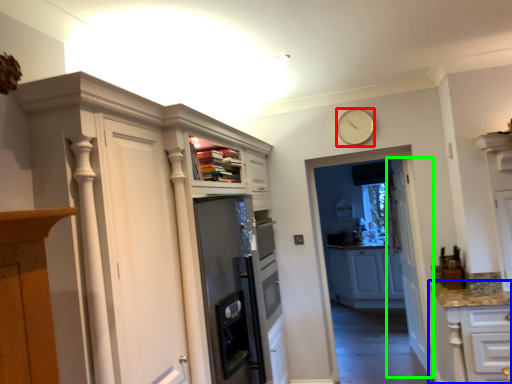
Question: Estimate the real-world distances between objects in this image. Which object is closer to clock (highlighted by a red box), cabinetry (highlighted by a blue box) or door (highlighted by a green box)?

Choices:
 (A) cabinetry
 (B) door

Answer: (B)